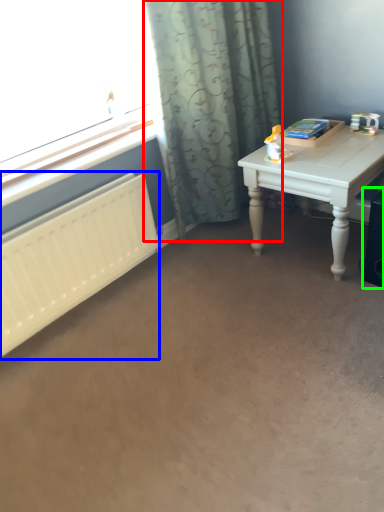
Question: Which is nearer to the curtain (highlighted by a red box)? radiator (highlighted by a blue box) or speaker (highlighted by a green box).

Choices:
 (A) radiator
 (B) speaker

Answer: (A)